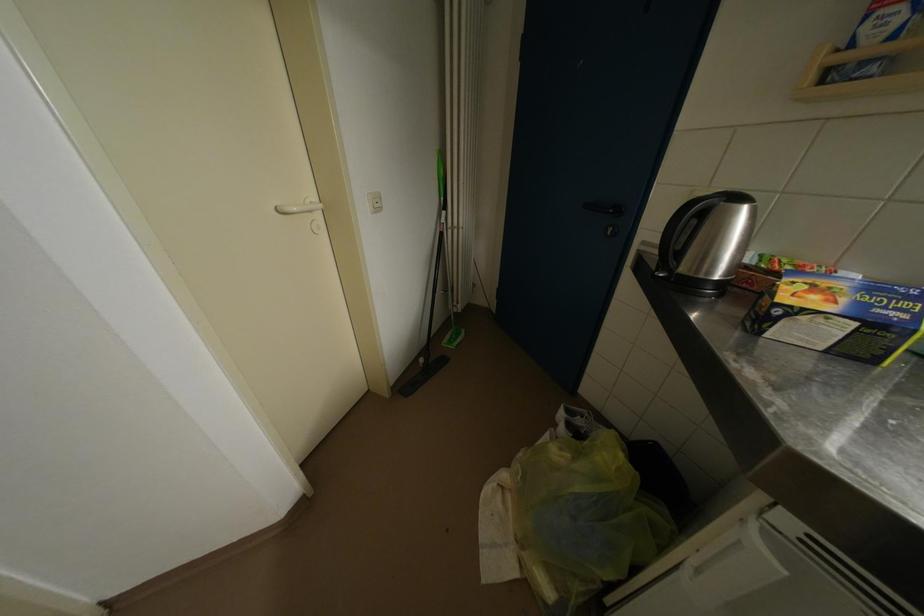
Locate an element on the screen. The width and height of the screenshot is (924, 616). black broom is located at coordinates (431, 301).